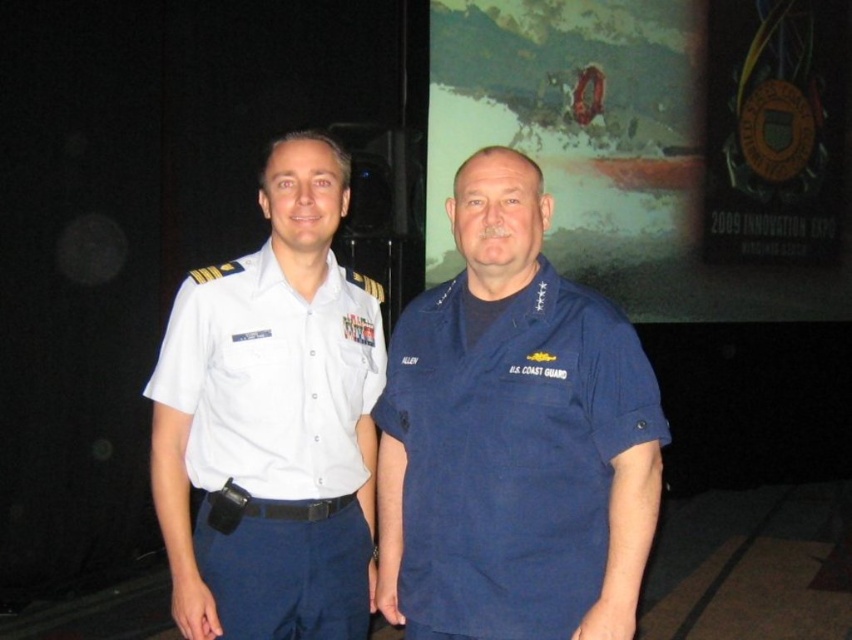
Question: Is navy blue fabric us coast guard uniform at center smaller than white cotton shirt at center?

Choices:
 (A) yes
 (B) no

Answer: (A)

Question: Is navy blue fabric us coast guard uniform at center positioned at the back of white cotton shirt at center?

Choices:
 (A) yes
 (B) no

Answer: (B)

Question: Among these objects, which one is nearest to the camera?

Choices:
 (A) white cotton shirt at center
 (B) navy blue fabric us coast guard uniform at center

Answer: (B)

Question: Which of the following is the farthest from the observer?

Choices:
 (A) (435, 433)
 (B) (185, 417)

Answer: (B)

Question: Can you confirm if navy blue fabric us coast guard uniform at center is positioned below white cotton shirt at center?

Choices:
 (A) yes
 (B) no

Answer: (A)